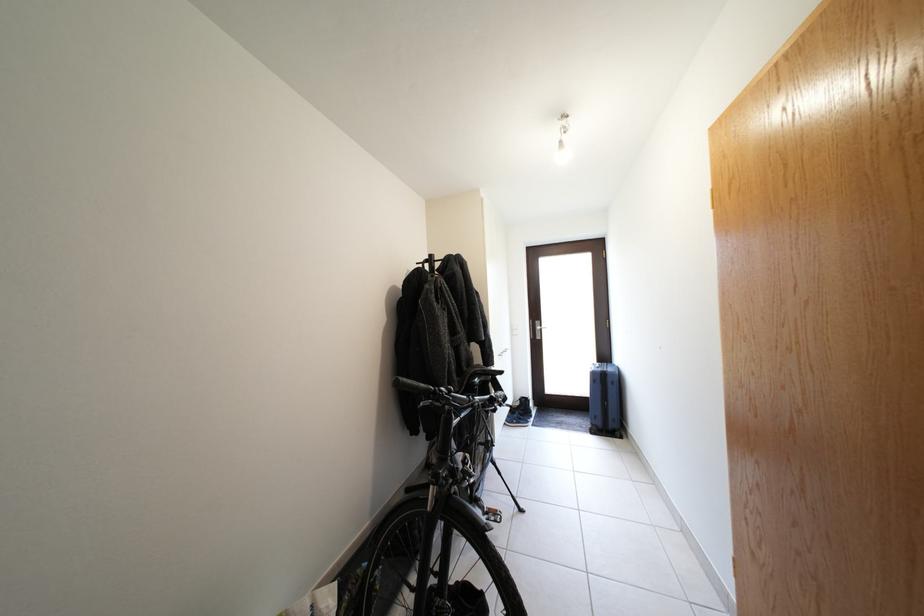
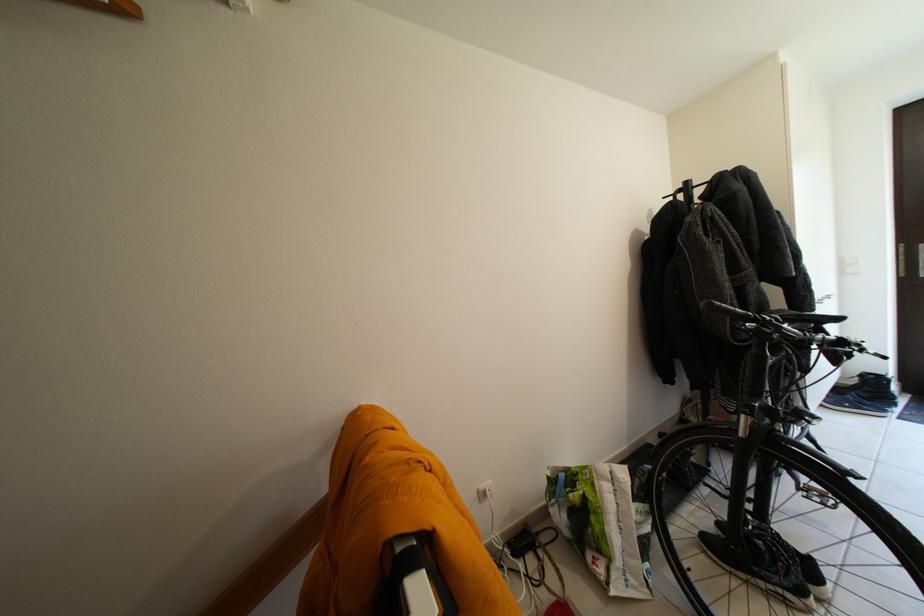
Where in the second image is the point corresponding to the point at 520,416 from the first image?

(845, 395)